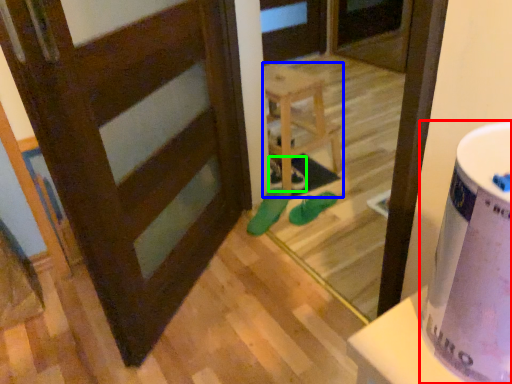
Question: Which object is positioned farthest from potty (highlighted by a red box)? Select from furniture (highlighted by a blue box) and shoe (highlighted by a green box).

Choices:
 (A) furniture
 (B) shoe

Answer: (B)